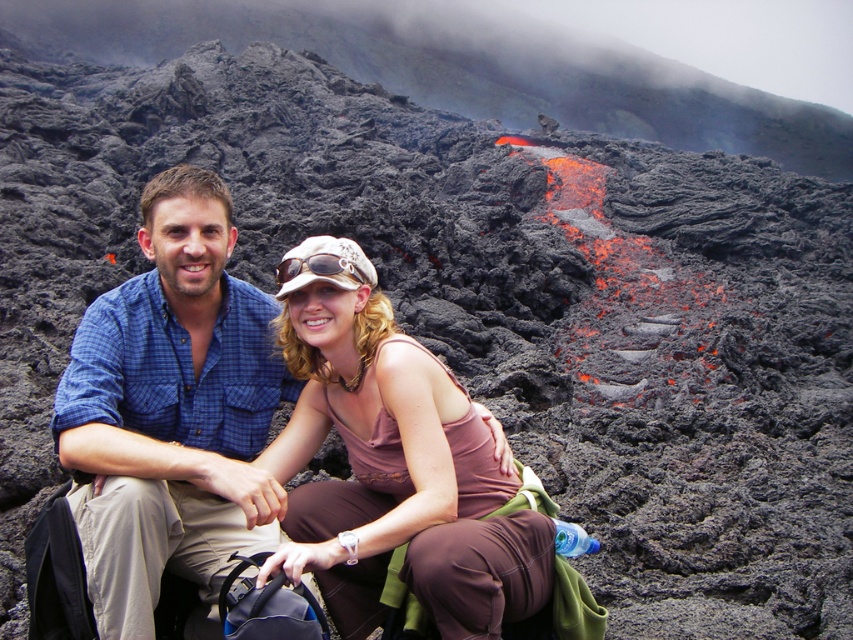
You are a photographer positioned at the origin point of the image. You want to capture a closeup shot of the blue plaid shirt at center. Which direction should you move your camera to focus on the shirt?

The blue plaid shirt at center is located at point [172,413]. Since the coordinates are relative to the image, moving the camera towards the right and slightly downward from the origin point will position the focus on the shirt.

You are a photographer trying to capture the perfect shot of the blue plaid shirt at center and the pink fabric at center. Since you want to highlight both subjects equally, which clothing item should you adjust to ensure they occupy the same amount of space in the frame?

The blue plaid shirt at center currently occupies less space than the pink fabric at center. To balance them, you should move the blue plaid shirt at center closer to the camera so it occupies more space, or move the pink fabric at center farther away to reduce its size in the frame.

You are a photographer standing in front of the two people in the image. You want to take a photo of the blue plaid shirt at center and the pink fabric at center. Which one will appear closer to you in the photo?

The blue plaid shirt at center will appear closer to you in the photo because it is positioned closer to the viewer than the pink fabric at center.